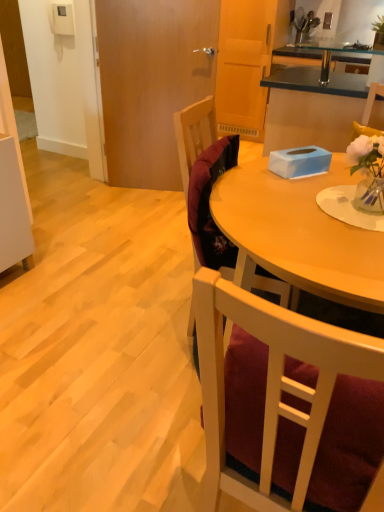
The width and height of the screenshot is (384, 512). I want to click on velvet burgundy chair at center, the 1th chair when ordered from front to back, so click(287, 401).

At what (x,y) coordinates should I click in order to perform the action: click on blue matte tissue box at center. Please return your answer as a coordinate pair (x, y). Looking at the image, I should click on (312, 109).

This screenshot has width=384, height=512. Find the location of `velvet burgundy chair at center, the 2th chair when ordered from front to back`. velvet burgundy chair at center, the 2th chair when ordered from front to back is located at coordinates (194, 135).

Locate an element on the screen. The height and width of the screenshot is (512, 384). velvet burgundy chair at center, the second chair viewed from the back is located at coordinates (287, 401).

Is velvet burgundy chair at center, the 2th chair when ordered from front to back, positioned with its back to blue matte tissue box at center?

No, velvet burgundy chair at center, the 2th chair when ordered from front to back, is not facing away from blue matte tissue box at center.

Consider the image. From a real-world perspective, is velvet burgundy chair at center, which ranks as the 1th chair in back-to-front order, over blue matte tissue box at center?

No, from a real-world perspective, velvet burgundy chair at center, which ranks as the 1th chair in back-to-front order, is not above blue matte tissue box at center.

Is velvet burgundy chair at center, which ranks as the 1th chair in back-to-front order, placed right next to blue matte tissue box at center?

No, velvet burgundy chair at center, which ranks as the 1th chair in back-to-front order, is not touching blue matte tissue box at center.

From a real-world perspective, who is located higher, blue matte tissue box at center or velvet burgundy chair at center, the second chair viewed from the back?

blue matte tissue box at center.

Consider the image. In terms of size, does blue matte tissue box at center appear bigger or smaller than velvet burgundy chair at center, the 1th chair when ordered from front to back?

Considering their sizes, blue matte tissue box at center takes up more space than velvet burgundy chair at center, the 1th chair when ordered from front to back.

From the image's perspective, which is above, blue matte tissue box at center or velvet burgundy chair at center, the second chair viewed from the back?

blue matte tissue box at center.

Considering the points (346, 83) and (383, 384), which point is behind, point (346, 83) or point (383, 384)?

The point (346, 83) is farther.

From a real-world perspective, count 1st chairs downward from the blue matte tissue box at center and point to it. Please provide its 2D coordinates.

[(194, 135)]

Is blue matte tissue box at center oriented away from velvet burgundy chair at center, which ranks as the 1th chair in back-to-front order?

Yes.

From a real-world perspective, which object rests below the other?

velvet burgundy chair at center, the 2th chair when ordered from front to back, from a real-world perspective.

Can you confirm if velvet burgundy chair at center, which ranks as the 1th chair in back-to-front order, is thinner than velvet burgundy chair at center, the second chair viewed from the back?

No, velvet burgundy chair at center, which ranks as the 1th chair in back-to-front order, is not thinner than velvet burgundy chair at center, the second chair viewed from the back.

Is velvet burgundy chair at center, the 2th chair when ordered from front to back, directly adjacent to velvet burgundy chair at center, the second chair viewed from the back?

They are not placed beside each other.

Which is closer, (190, 124) or (310, 480)?

Point (190, 124) is farther from the camera than point (310, 480).

From a real-world perspective, which is physically above, velvet burgundy chair at center, which ranks as the 1th chair in back-to-front order, or velvet burgundy chair at center, the 1th chair when ordered from front to back?

velvet burgundy chair at center, which ranks as the 1th chair in back-to-front order.

From the image's perspective, which one is positioned higher, velvet burgundy chair at center, the second chair viewed from the back, or blue matte tissue box at center?

blue matte tissue box at center, from the image's perspective.

Does velvet burgundy chair at center, the second chair viewed from the back, touch blue matte tissue box at center?

No, velvet burgundy chair at center, the second chair viewed from the back, is not making contact with blue matte tissue box at center.

Where is `cabinetry above the velvet burgundy chair at center, the second chair viewed from the back (from the image's perspective)`? The width and height of the screenshot is (384, 512). cabinetry above the velvet burgundy chair at center, the second chair viewed from the back (from the image's perspective) is located at coordinates (312, 109).

Does velvet burgundy chair at center, the 1th chair when ordered from front to back, lie behind blue matte tissue box at center?

No, velvet burgundy chair at center, the 1th chair when ordered from front to back, is closer to the viewer.

The width and height of the screenshot is (384, 512). I want to click on chair to the right of velvet burgundy chair at center, which ranks as the 1th chair in back-to-front order, so click(287, 401).

Can velvet burgundy chair at center, which ranks as the 1th chair in back-to-front order, be found inside velvet burgundy chair at center, the 1th chair when ordered from front to back?

No, velvet burgundy chair at center, which ranks as the 1th chair in back-to-front order, is not inside velvet burgundy chair at center, the 1th chair when ordered from front to back.

Who is smaller, velvet burgundy chair at center, the second chair viewed from the back, or velvet burgundy chair at center, the 2th chair when ordered from front to back?

velvet burgundy chair at center, the 2th chair when ordered from front to back.

In the scene shown: From a real-world perspective, is velvet burgundy chair at center, the second chair viewed from the back, over velvet burgundy chair at center, which ranks as the 1th chair in back-to-front order?

No, from a real-world perspective, velvet burgundy chair at center, the second chair viewed from the back, is not on top of velvet burgundy chair at center, which ranks as the 1th chair in back-to-front order.

This screenshot has height=512, width=384. I want to click on cabinetry above the velvet burgundy chair at center, which ranks as the 1th chair in back-to-front order (from a real-world perspective), so click(x=312, y=109).

Where is `chair that is the 2nd one below the blue matte tissue box at center (from a real-world perspective)`? chair that is the 2nd one below the blue matte tissue box at center (from a real-world perspective) is located at coordinates (287, 401).

Based on their spatial positions, is velvet burgundy chair at center, which ranks as the 1th chair in back-to-front order, or velvet burgundy chair at center, the second chair viewed from the back, closer to blue matte tissue box at center?

velvet burgundy chair at center, which ranks as the 1th chair in back-to-front order, is positioned closer to the anchor blue matte tissue box at center.

Which object lies further to the anchor point velvet burgundy chair at center, the 1th chair when ordered from front to back, blue matte tissue box at center or velvet burgundy chair at center, which ranks as the 1th chair in back-to-front order?

blue matte tissue box at center is positioned further to the anchor velvet burgundy chair at center, the 1th chair when ordered from front to back.

Based on the photo, which object lies nearer to the anchor point velvet burgundy chair at center, the 2th chair when ordered from front to back, velvet burgundy chair at center, the 1th chair when ordered from front to back, or blue matte tissue box at center?

The object closer to velvet burgundy chair at center, the 2th chair when ordered from front to back, is velvet burgundy chair at center, the 1th chair when ordered from front to back.

Which object lies nearer to the anchor point velvet burgundy chair at center, the 1th chair when ordered from front to back, velvet burgundy chair at center, the 2th chair when ordered from front to back, or blue matte tissue box at center?

Among the two, velvet burgundy chair at center, the 2th chair when ordered from front to back, is located nearer to velvet burgundy chair at center, the 1th chair when ordered from front to back.

Which object lies further to the anchor point blue matte tissue box at center, velvet burgundy chair at center, the 1th chair when ordered from front to back, or velvet burgundy chair at center, which ranks as the 1th chair in back-to-front order?

velvet burgundy chair at center, the 1th chair when ordered from front to back, is positioned further to the anchor blue matte tissue box at center.

When comparing their distances from velvet burgundy chair at center, which ranks as the 1th chair in back-to-front order, does blue matte tissue box at center or velvet burgundy chair at center, the second chair viewed from the back, seem closer?

The object closer to velvet burgundy chair at center, which ranks as the 1th chair in back-to-front order, is velvet burgundy chair at center, the second chair viewed from the back.

This screenshot has height=512, width=384. I want to click on chair between velvet burgundy chair at center, the 1th chair when ordered from front to back, and blue matte tissue box at center, along the z-axis, so click(x=194, y=135).